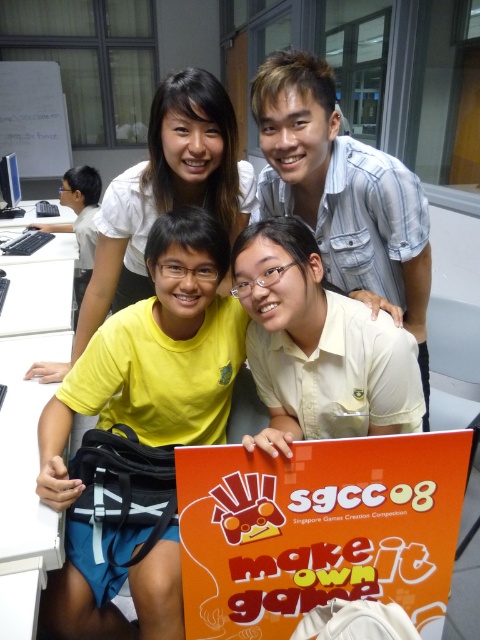
You are trying to decide whether to place a new rectangular box that is 10 cm thick on the table. The box must be placed in the space between the white matte shirt at center and the white plastic table at lower left. Can the box fit there?

The white matte shirt at center is thinner than the white plastic table at lower left, so the space between them might be sufficient for the 10 cm thick box. However, since the exact distance isn

You are standing in the room and want to reach the white plastic table at lower left without moving the yellow fabric shirt at lower left. Is it possible?

The yellow fabric shirt at lower left is further to the viewer than the white plastic table at lower left, so you can reach the white plastic table at lower left without moving the yellow fabric shirt at lower left because it is closer to you.

You are a photographer trying to capture the best angle of the yellow fabric shirt at lower left and the white plastic table at lower left. Which object is taller?

The yellow fabric shirt at lower left is taller than the white plastic table at lower left according to the description.